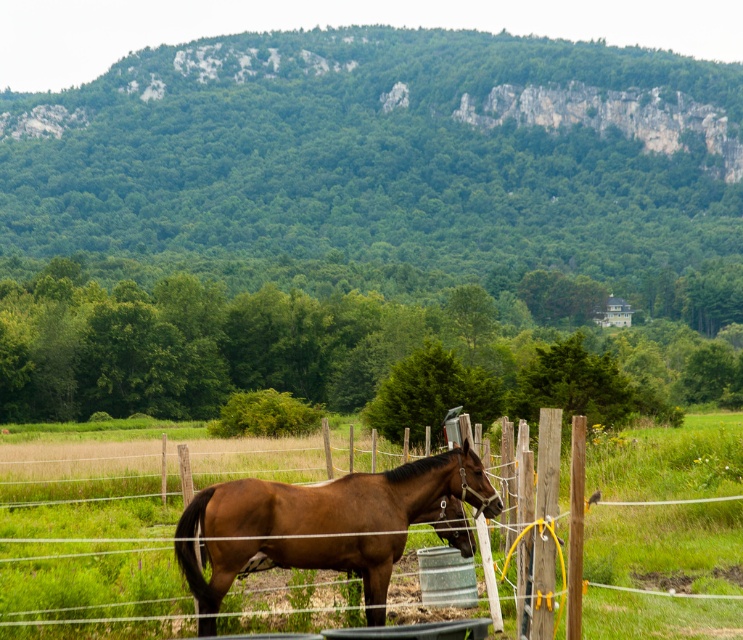
You are standing at the point with coordinates point [386,518] and want to walk to the point with coordinates point [721,321]. Is the point you want to reach located behind you or in front of you?

The point [721,321] is behind point [386,518], so the destination is behind you.

You are a photographer planning to take a picture of the green leafy hillside at upper center and the brown glossy horse at center. Which object will occupy more space in the photo?

The green leafy hillside at upper center will occupy more space in the photo because it is larger in size than the brown glossy horse at center.